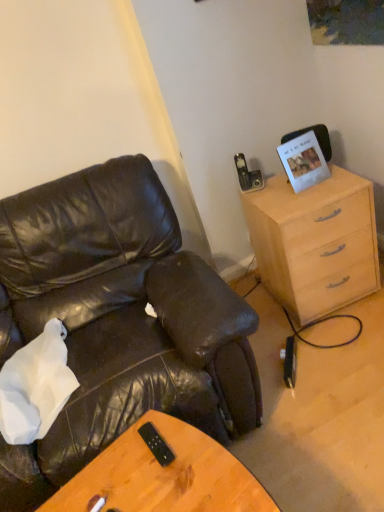
Where is `vacant space in front of white paper picture frame at upper right`? This screenshot has width=384, height=512. vacant space in front of white paper picture frame at upper right is located at coordinates (327, 199).